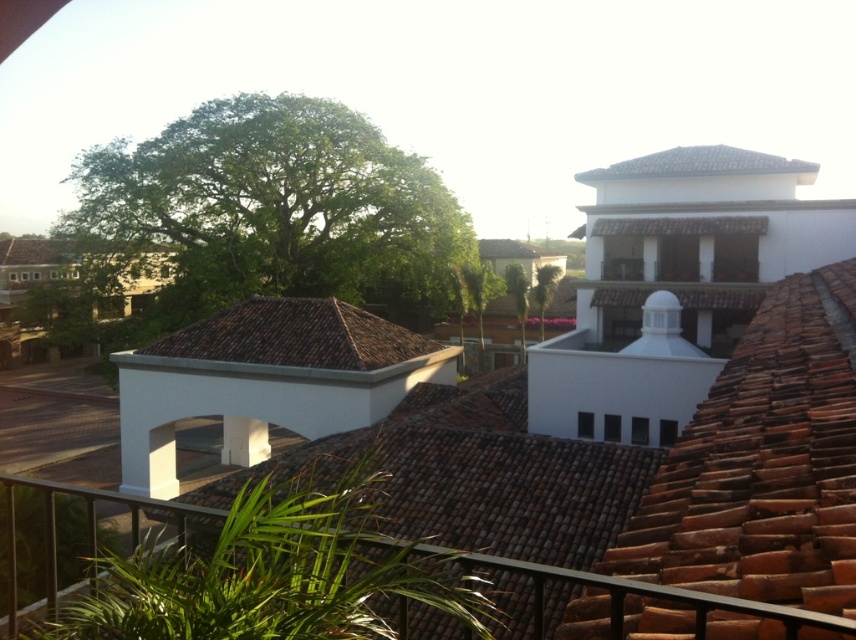
Consider the image. You are a painter standing at the lower center of the scene, holding a large canvas. You want to paint both the metallic gray railing at lower center and the brown tile roof at center. Which object should you focus on first if you want to paint the larger one first?

The metallic gray railing at lower center has a larger size compared to brown tile roof at center, so you should focus on painting the metallic gray railing at lower center first.

You are standing at the lower part of the image and want to reach the brown tile roof at center. Which direction should you move relative to the metallic gray railing at lower center?

You should move above the metallic gray railing at lower center to reach the brown tile roof at center since the railing is below the roof.

You are standing at the edge of the residential area depicted in the scene. You notice a metallic gray railing at lower center. Could you provide the exact coordinates of where this railing is located in the image?

The metallic gray railing at lower center is located at coordinates point (616, 589).